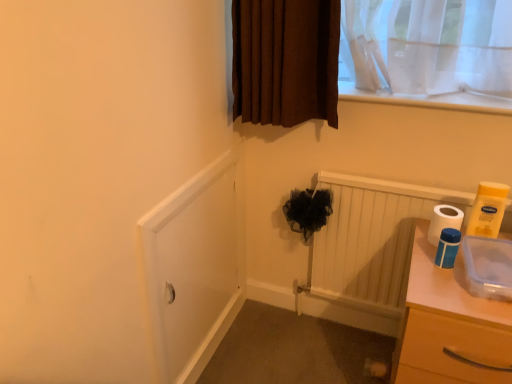
This screenshot has width=512, height=384. I want to click on free space above white wooden radiator at lower center (from a real-world perspective), so click(411, 169).